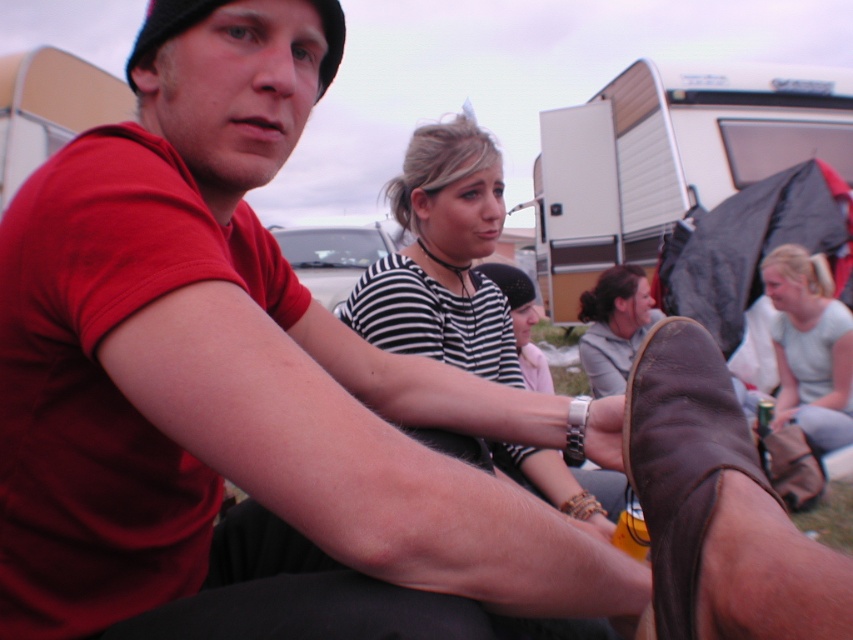
You are a photographer trying to capture a candid shot of the striped fabric shirt at center and the brown leather shoe at lower right. Since you want to ensure both subjects are in focus, you need to know which one is closer to the camera. Can you determine which is closer?

The brown leather shoe at lower right is shorter than striped fabric shirt at center, so the brown leather shoe at lower right is closer to the camera.

You are standing at the point labeled as point [432,273] and want to walk to the campfire located at point [635,451]. Is the campfire in front of you or behind you?

The campfire at point [635,451] is in front of you because it is in front of point [432,273] where you are standing.